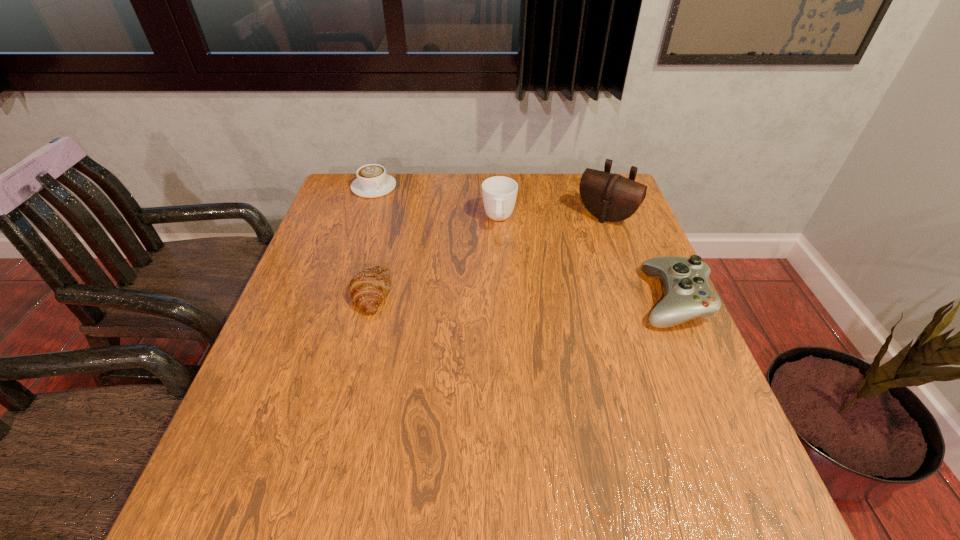
The width and height of the screenshot is (960, 540). Find the location of `free space between the crescent roll and the cappuccino`. free space between the crescent roll and the cappuccino is located at coordinates (372, 240).

What are the coordinates of `object that stands as the third closest to the farthest object` in the screenshot? It's located at (610, 197).

Identify which object is located as the nearest to the cappuccino. Please provide its 2D coordinates. Your answer should be formatted as a tuple, i.e. [(x, y)], where the tuple contains the x and y coordinates of a point satisfying the conditions above.

[(499, 193)]

You are a GUI agent. You are given a task and a screenshot of the screen. Output one action in this format:
    pyautogui.click(x=<x>, y=<y>)
    Task: Click on the free space that satisfies the following two spatial constraints: 1. on the front side of the cappuccino; 2. on the right side of the third shortest object
    
    Given the screenshot: What is the action you would take?
    pyautogui.click(x=337, y=299)

The width and height of the screenshot is (960, 540). Identify the location of free space that satisfies the following two spatial constraints: 1. on the front side of the crescent roll; 2. on the left side of the third shortest object. (370, 299).

I want to click on free space that satisfies the following two spatial constraints: 1. on the front side of the farthest object; 2. on the right side of the control, so click(337, 299).